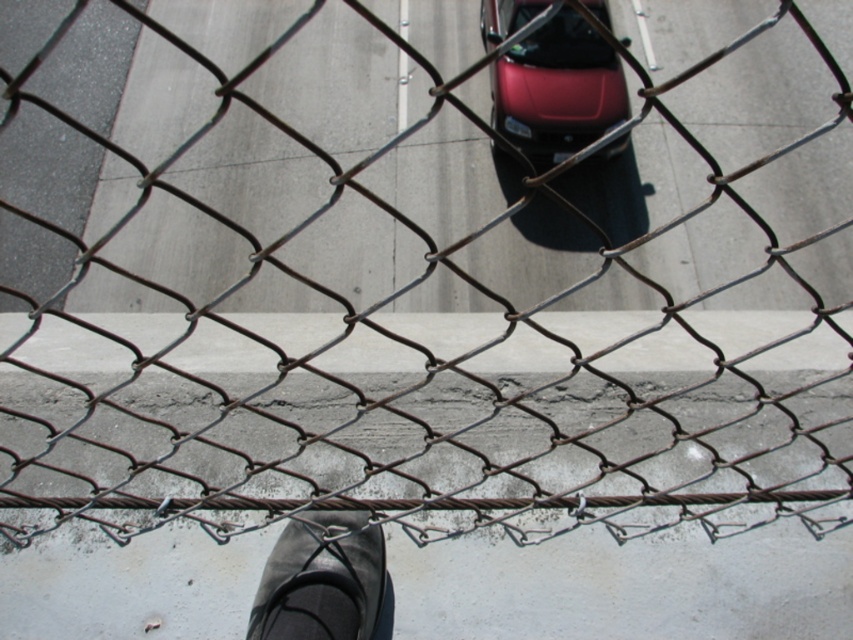
You are a delivery person trying to determine if your package can fit through the space between the glossy red car at center and the black rubber shoe at lower center. The package is 1.2 meters wide. Can it fit?

The glossy red car at center is bigger than the black rubber shoe at lower center, but the exact width between them isn

You are standing behind a chainlink fence looking down at a roadway. You see a glossy red car at center. Can you determine if the car is closer to the fence or the edge of the road?

The glossy red car at center is located at point (556, 88), which places it closer to the fence than the edge of the road.